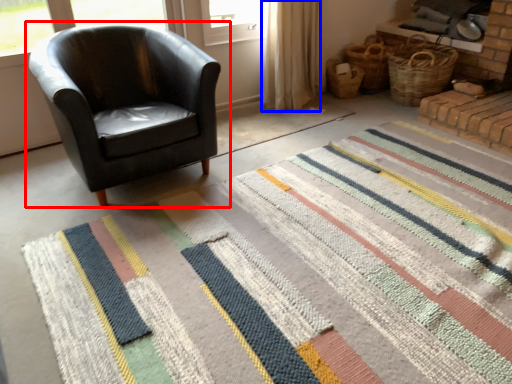
Question: Which object is further to the camera taking this photo, chair (highlighted by a red box) or curtain (highlighted by a blue box)?

Choices:
 (A) chair
 (B) curtain

Answer: (B)